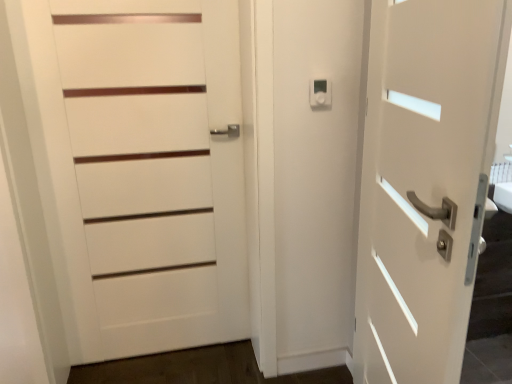
Question: Looking at their shapes, would you say white matte door at left, positioned as the second door in right-to-left order, is wider or thinner than white matte door at right, positioned as the 2th door in left-to-right order?

Choices:
 (A) thin
 (B) wide

Answer: (A)

Question: Is white matte door at left, the 1th door from the left, bigger or smaller than white matte door at right, which is counted as the first door, starting from the right?

Choices:
 (A) big
 (B) small

Answer: (B)

Question: Estimate the real-world distances between objects in this image. Which object is farther from the white matte door at left, positioned as the second door in right-to-left order?

Choices:
 (A) white matte door at right, which is counted as the first door, starting from the right
 (B) white plastic thermostat at upper center

Answer: (A)

Question: Based on their relative distances, which object is nearer to the white matte door at left, the 1th door from the left?

Choices:
 (A) white matte door at right, positioned as the 2th door in left-to-right order
 (B) white plastic thermostat at upper center

Answer: (B)